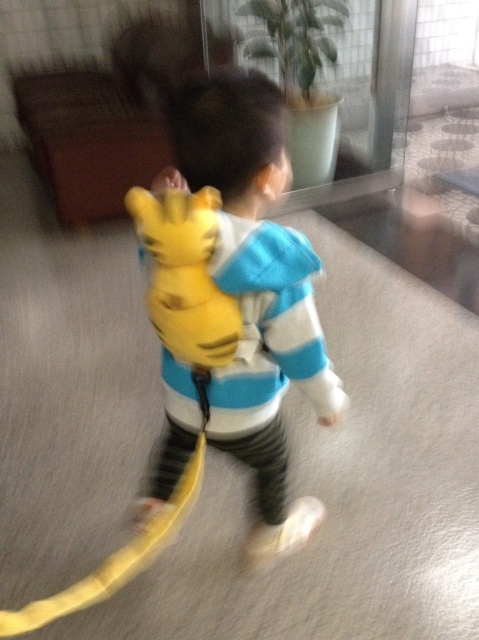
The image size is (479, 640). I want to click on yellow plush backpack at center, so click(255, 285).

You are a GUI agent. You are given a task and a screenshot of the screen. Output one action in this format:
    pyautogui.click(x=<x>, y=<y>)
    Task: Click on the yellow plush backpack at center
    The height and width of the screenshot is (640, 479).
    Given the screenshot: What is the action you would take?
    pyautogui.click(x=255, y=285)